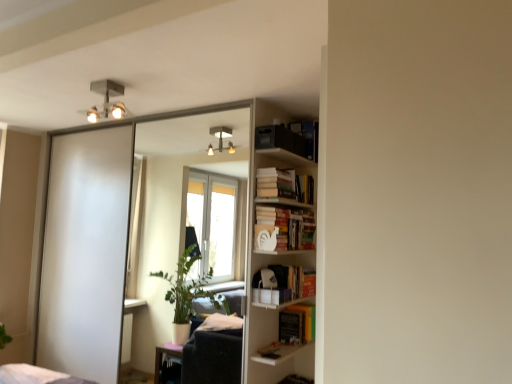
Question: Considering the relative sizes of white matte bookshelf at center-right, placed as the second book when sorted from bottom to top, and metallic square light fixture at upper center in the image provided, is white matte bookshelf at center-right, placed as the second book when sorted from bottom to top, thinner than metallic square light fixture at upper center?

Choices:
 (A) no
 (B) yes

Answer: (B)

Question: Is white matte bookshelf at center-right, acting as the third book starting from the top, facing away from metallic square light fixture at upper center?

Choices:
 (A) no
 (B) yes

Answer: (A)

Question: Is white matte bookshelf at center-right, placed as the second book when sorted from bottom to top, closer to camera compared to metallic square light fixture at upper center?

Choices:
 (A) yes
 (B) no

Answer: (B)

Question: From a real-world perspective, is white matte bookshelf at center-right, placed as the second book when sorted from bottom to top, positioned over metallic square light fixture at upper center based on gravity?

Choices:
 (A) no
 (B) yes

Answer: (A)

Question: Considering the relative positions of white matte bookshelf at center-right, placed as the second book when sorted from bottom to top, and metallic square light fixture at upper center in the image provided, is white matte bookshelf at center-right, placed as the second book when sorted from bottom to top, to the left of metallic square light fixture at upper center from the viewer's perspective?

Choices:
 (A) yes
 (B) no

Answer: (B)

Question: Considering the positions of metallic square light fixture at upper center and clear glass mirror at upper center in the image, is metallic square light fixture at upper center bigger or smaller than clear glass mirror at upper center?

Choices:
 (A) big
 (B) small

Answer: (B)

Question: Would you say metallic square light fixture at upper center is inside or outside clear glass mirror at upper center?

Choices:
 (A) inside
 (B) outside

Answer: (B)

Question: In the image, is metallic square light fixture at upper center positioned in front of or behind clear glass mirror at upper center?

Choices:
 (A) front
 (B) behind

Answer: (A)

Question: Looking at their shapes, would you say metallic square light fixture at upper center is wider or thinner than clear glass mirror at upper center?

Choices:
 (A) wide
 (B) thin

Answer: (A)

Question: Is matte black bookshelf at upper right, which is counted as the 4th book, starting from the bottom, wider or thinner than yellow matte book at center, which ranks as the 1th book in bottom-to-top order?

Choices:
 (A) thin
 (B) wide

Answer: (B)

Question: Considering the positions of matte black bookshelf at upper right, which is counted as the 4th book, starting from the bottom, and yellow matte book at center, which is the 4th book from top to bottom, in the image, is matte black bookshelf at upper right, which is counted as the 4th book, starting from the bottom, taller or shorter than yellow matte book at center, which is the 4th book from top to bottom,?

Choices:
 (A) tall
 (B) short

Answer: (B)

Question: Relative to yellow matte book at center, which ranks as the 1th book in bottom-to-top order, is matte black bookshelf at upper right, which is counted as the 4th book, starting from the bottom, in front or behind?

Choices:
 (A) behind
 (B) front

Answer: (B)

Question: Is point (314, 160) positioned closer to the camera than point (286, 306)?

Choices:
 (A) closer
 (B) farther

Answer: (B)

Question: In terms of height, does white matte bookshelf at right look taller or shorter compared to matte black bookshelf at upper right, which ranks as the 1th book in top-to-bottom order?

Choices:
 (A) short
 (B) tall

Answer: (B)

Question: From the image's perspective, relative to matte black bookshelf at upper right, which is counted as the 4th book, starting from the bottom, is white matte bookshelf at right above or below?

Choices:
 (A) below
 (B) above

Answer: (A)